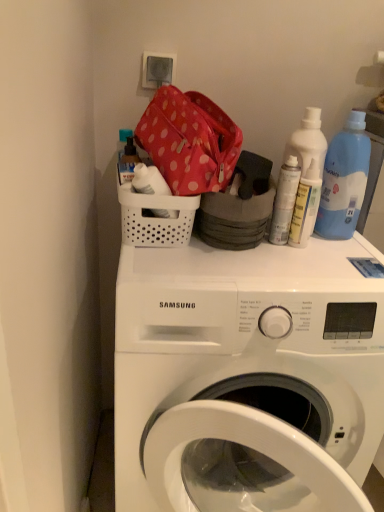
Question: Does white plastic washing machine at upper center come behind blue plastic bottle at upper right?

Choices:
 (A) yes
 (B) no

Answer: (B)

Question: Does white plastic washing machine at upper center have a larger size compared to blue plastic bottle at upper right?

Choices:
 (A) no
 (B) yes

Answer: (B)

Question: From the image's perspective, is white plastic washing machine at upper center on top of blue plastic bottle at upper right?

Choices:
 (A) no
 (B) yes

Answer: (A)

Question: Does white plastic washing machine at upper center appear on the right side of blue plastic bottle at upper right?

Choices:
 (A) no
 (B) yes

Answer: (A)

Question: Does white plastic washing machine at upper center have a smaller size compared to blue plastic bottle at upper right?

Choices:
 (A) yes
 (B) no

Answer: (B)

Question: Visually, is white matte spray can at upper right, placed as the second bottle when sorted from right to left, positioned to the left or to the right of translucent plastic spray can at upper right, the 1th bottle positioned from the right?

Choices:
 (A) left
 (B) right

Answer: (A)

Question: Looking at their shapes, would you say white matte spray can at upper right, the second bottle positioned from the left, is wider or thinner than translucent plastic spray can at upper right, the third bottle positioned from the left?

Choices:
 (A) wide
 (B) thin

Answer: (B)

Question: From the image's perspective, is white matte spray can at upper right, placed as the second bottle when sorted from right to left, above or below translucent plastic spray can at upper right, the third bottle positioned from the left?

Choices:
 (A) above
 (B) below

Answer: (A)

Question: From a real-world perspective, is white matte spray can at upper right, the second bottle positioned from the left, physically located above or below translucent plastic spray can at upper right, the 1th bottle positioned from the right?

Choices:
 (A) below
 (B) above

Answer: (B)

Question: From their relative heights in the image, would you say white plastic washing machine at upper center is taller or shorter than white plastic basket at upper center?

Choices:
 (A) tall
 (B) short

Answer: (A)

Question: In terms of width, does white plastic washing machine at upper center look wider or thinner when compared to white plastic basket at upper center?

Choices:
 (A) wide
 (B) thin

Answer: (A)

Question: Based on their sizes in the image, would you say white plastic washing machine at upper center is bigger or smaller than white plastic basket at upper center?

Choices:
 (A) small
 (B) big

Answer: (B)

Question: From a real-world perspective, is white plastic washing machine at upper center physically located above or below white plastic basket at upper center?

Choices:
 (A) below
 (B) above

Answer: (A)

Question: In terms of width, does white matte spray can at upper right, placed as the second bottle when sorted from right to left, look wider or thinner when compared to translucent plastic soap dispenser at upper left, the 3th bottle when ordered from right to left?

Choices:
 (A) thin
 (B) wide

Answer: (A)

Question: Is point (274, 202) positioned closer to the camera than point (135, 153)?

Choices:
 (A) farther
 (B) closer

Answer: (B)